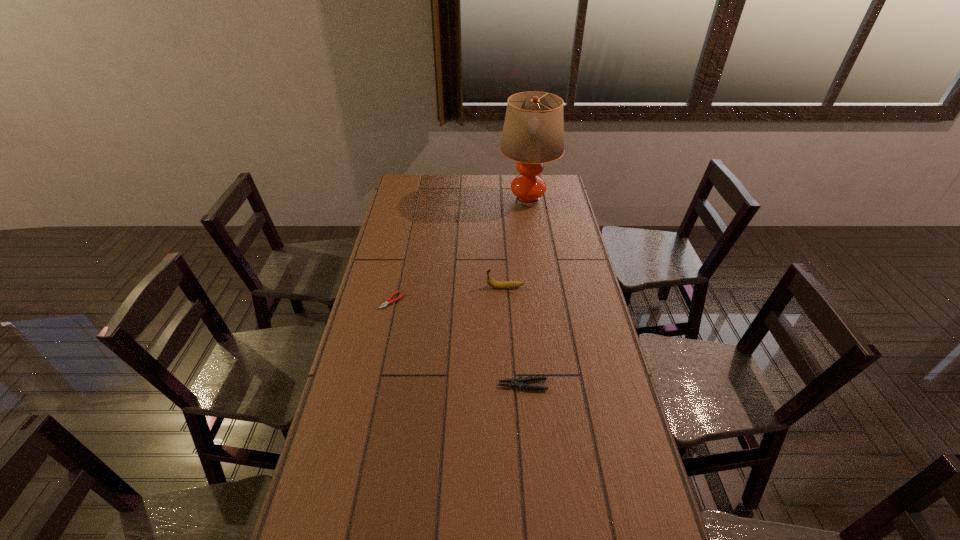
Locate an element on the screen. vacant space in between the farther pliers and the third nearest object is located at coordinates (448, 294).

Where is `the second closest object relative to the third farthest object`? the second closest object relative to the third farthest object is located at coordinates (519, 382).

Point out which object is positioned as the nearest to the shortest object. Please provide its 2D coordinates. Your answer should be formatted as a tuple, i.e. [(x, y)], where the tuple contains the x and y coordinates of a point satisfying the conditions above.

[(495, 284)]